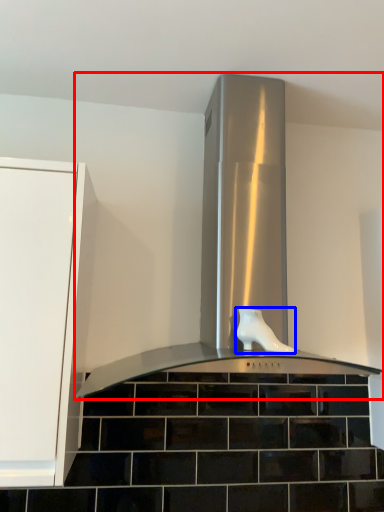
Question: Which point is further to the camera, home appliance (highlighted by a red box) or footwear (highlighted by a blue box)?

Choices:
 (A) home appliance
 (B) footwear

Answer: (B)